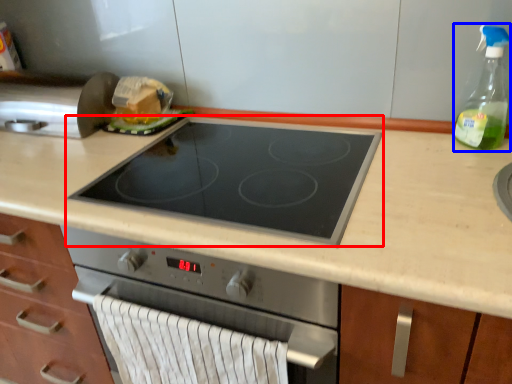
Question: Among these objects, which one is farthest to the camera, gas stove (highlighted by a red box) or bottle (highlighted by a blue box)?

Choices:
 (A) gas stove
 (B) bottle

Answer: (B)